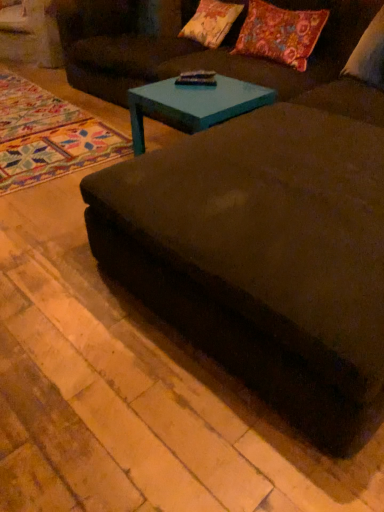
Identify the location of floral fabric pillow at upper center, which appears as the 1th pillow when viewed from the left. This screenshot has width=384, height=512. (211, 22).

You are a GUI agent. You are given a task and a screenshot of the screen. Output one action in this format:
    pyautogui.click(x=<x>, y=<y>)
    Task: Click on the white soft pillow at upper right, which appears as the 3th pillow when viewed from the left
    
    Given the screenshot: What is the action you would take?
    pyautogui.click(x=369, y=54)

In order to click on floral fabric pillow at upper center, which appears as the 1th pillow when viewed from the left in this screenshot , I will do `click(211, 22)`.

In terms of width, does multicolored woven rug at lower left look wider or thinner when compared to dark brown fabric couch at center?

Clearly, multicolored woven rug at lower left has more width compared to dark brown fabric couch at center.

From the image's perspective, which one is positioned higher, multicolored woven rug at lower left or dark brown fabric couch at center?

dark brown fabric couch at center.

Is multicolored woven rug at lower left with dark brown fabric couch at center?

They are not placed beside each other.

Is multicolored woven rug at lower left taller or shorter than dark brown fabric couch at center?

In the image, multicolored woven rug at lower left appears to be shorter than dark brown fabric couch at center.

Considering the sizes of objects teal glossy coffee table at center and multicolored woven rug at lower left in the image provided, who is smaller, teal glossy coffee table at center or multicolored woven rug at lower left?

teal glossy coffee table at center is smaller.

Is teal glossy coffee table at center completely or partially outside of multicolored woven rug at lower left?

teal glossy coffee table at center lies outside multicolored woven rug at lower left's area.

Between teal glossy coffee table at center and multicolored woven rug at lower left, which one appears on the left side from the viewer's perspective?

multicolored woven rug at lower left.

From a real-world perspective, is teal glossy coffee table at center physically located above or below multicolored woven rug at lower left?

teal glossy coffee table at center is situated higher than multicolored woven rug at lower left in the real world.

From the picture: From the image's perspective, between floral fabric pillow at upper right, which is the second pillow in right-to-left order, and floral fabric pillow at upper center, marked as the 3th pillow in a right-to-left arrangement, which one is located above?

floral fabric pillow at upper center, marked as the 3th pillow in a right-to-left arrangement, from the image's perspective.

Looking at this image, which object is further away from the camera taking this photo, floral fabric pillow at upper right, which ranks as the 2th pillow in left-to-right order, or floral fabric pillow at upper center, marked as the 3th pillow in a right-to-left arrangement?

floral fabric pillow at upper center, marked as the 3th pillow in a right-to-left arrangement.

Which is behind, point (260, 17) or point (211, 30)?

The point (211, 30) is behind.

Is floral fabric pillow at upper center, which appears as the 1th pillow when viewed from the left, a part of floral fabric pillow at upper right, which is the second pillow in right-to-left order?

No, floral fabric pillow at upper center, which appears as the 1th pillow when viewed from the left, is not surrounded by floral fabric pillow at upper right, which is the second pillow in right-to-left order.

Is there a large distance between velvet dark brown couch at center and multicolored woven rug at lower left?

velvet dark brown couch at center is far away from multicolored woven rug at lower left.

The width and height of the screenshot is (384, 512). Identify the location of studio couch that appears below the multicolored woven rug at lower left (from the image's perspective). (266, 252).

Is the position of velvet dark brown couch at center less distant than that of multicolored woven rug at lower left?

Yes, it is in front of multicolored woven rug at lower left.

From the image's perspective, is velvet dark brown couch at center beneath multicolored woven rug at lower left?

Indeed, from the image's perspective, velvet dark brown couch at center is shown beneath multicolored woven rug at lower left.

Which object is closer to the camera taking this photo, velvet dark brown couch at center or floral fabric pillow at upper center, marked as the 3th pillow in a right-to-left arrangement?

velvet dark brown couch at center.

The width and height of the screenshot is (384, 512). Identify the location of the 1st pillow located above the velvet dark brown couch at center (from a real-world perspective). point(211,22).

Between velvet dark brown couch at center and floral fabric pillow at upper center, marked as the 3th pillow in a right-to-left arrangement, which one has larger size?

With larger size is velvet dark brown couch at center.

From a real-world perspective, is velvet dark brown couch at center physically located above or below floral fabric pillow at upper center, marked as the 3th pillow in a right-to-left arrangement?

velvet dark brown couch at center is below floral fabric pillow at upper center, marked as the 3th pillow in a right-to-left arrangement.

Considering the relative sizes of white soft pillow at upper right, acting as the first pillow starting from the right, and dark brown fabric couch at center in the image provided, is white soft pillow at upper right, acting as the first pillow starting from the right, bigger than dark brown fabric couch at center?

Incorrect, white soft pillow at upper right, acting as the first pillow starting from the right, is not larger than dark brown fabric couch at center.

From the image's perspective, between white soft pillow at upper right, acting as the first pillow starting from the right, and dark brown fabric couch at center, which one is located above?

From the image's view, dark brown fabric couch at center is above.

Considering the relative sizes of white soft pillow at upper right, acting as the first pillow starting from the right, and dark brown fabric couch at center in the image provided, is white soft pillow at upper right, acting as the first pillow starting from the right, taller than dark brown fabric couch at center?

In fact, white soft pillow at upper right, acting as the first pillow starting from the right, may be shorter than dark brown fabric couch at center.

Which is more to the right, white soft pillow at upper right, acting as the first pillow starting from the right, or dark brown fabric couch at center?

white soft pillow at upper right, acting as the first pillow starting from the right, is more to the right.

Consider the image. Which is more to the right, floral fabric pillow at upper right, which ranks as the 2th pillow in left-to-right order, or dark brown fabric couch at center?

floral fabric pillow at upper right, which ranks as the 2th pillow in left-to-right order.

In terms of size, does floral fabric pillow at upper right, which is the second pillow in right-to-left order, appear bigger or smaller than dark brown fabric couch at center?

In the image, floral fabric pillow at upper right, which is the second pillow in right-to-left order, appears to be smaller than dark brown fabric couch at center.

From the image's perspective, who appears lower, floral fabric pillow at upper right, which is the second pillow in right-to-left order, or dark brown fabric couch at center?

dark brown fabric couch at center, from the image's perspective.

What are the coordinates of `mat behind the dark brown fabric couch at center` in the screenshot? It's located at (48, 136).

In the image, there is a teal glossy coffee table at center. In order to click on mat below it (from a real-world perspective) in this screenshot , I will do `click(48, 136)`.

Estimate the real-world distances between objects in this image. Which object is further from floral fabric pillow at upper right, which ranks as the 2th pillow in left-to-right order, multicolored woven rug at lower left or white soft pillow at upper right, which appears as the 3th pillow when viewed from the left?

multicolored woven rug at lower left.

Consider the image. Based on their spatial positions, is teal glossy coffee table at center or floral fabric pillow at upper center, which appears as the 1th pillow when viewed from the left, closer to multicolored woven rug at lower left?

teal glossy coffee table at center.

Considering their positions, is multicolored woven rug at lower left positioned further to floral fabric pillow at upper center, marked as the 3th pillow in a right-to-left arrangement, than floral fabric pillow at upper right, which is the second pillow in right-to-left order?

The object further to floral fabric pillow at upper center, marked as the 3th pillow in a right-to-left arrangement, is multicolored woven rug at lower left.

Estimate the real-world distances between objects in this image. Which object is further from dark brown fabric couch at center, floral fabric pillow at upper right, which is the second pillow in right-to-left order, or teal glossy coffee table at center?

teal glossy coffee table at center is further to dark brown fabric couch at center.

Which object lies further to the anchor point dark brown fabric couch at center, teal glossy coffee table at center or white soft pillow at upper right, which appears as the 3th pillow when viewed from the left?

The object further to dark brown fabric couch at center is white soft pillow at upper right, which appears as the 3th pillow when viewed from the left.

Estimate the real-world distances between objects in this image. Which object is closer to teal glossy coffee table at center, dark brown fabric couch at center or white soft pillow at upper right, which appears as the 3th pillow when viewed from the left?

dark brown fabric couch at center.

Based on their spatial positions, is velvet dark brown couch at center or multicolored woven rug at lower left closer to floral fabric pillow at upper right, which ranks as the 2th pillow in left-to-right order?

multicolored woven rug at lower left is positioned closer to the anchor floral fabric pillow at upper right, which ranks as the 2th pillow in left-to-right order.

Based on their spatial positions, is teal glossy coffee table at center or dark brown fabric couch at center further from floral fabric pillow at upper center, which appears as the 1th pillow when viewed from the left?

Based on the image, teal glossy coffee table at center appears to be further to floral fabric pillow at upper center, which appears as the 1th pillow when viewed from the left.

Image resolution: width=384 pixels, height=512 pixels. I want to click on coffee table situated between multicolored woven rug at lower left and dark brown fabric couch at center from left to right, so click(193, 103).

Identify the location of coffee table between velvet dark brown couch at center and floral fabric pillow at upper right, which is the second pillow in right-to-left order, along the z-axis. The height and width of the screenshot is (512, 384). (193, 103).

You are a GUI agent. You are given a task and a screenshot of the screen. Output one action in this format:
    pyautogui.click(x=<x>, y=<y>)
    Task: Click on the coffee table between dark brown fabric couch at center and floral fabric pillow at upper center, which appears as the 1th pillow when viewed from the left, along the z-axis
    This screenshot has width=384, height=512.
    Given the screenshot: What is the action you would take?
    pyautogui.click(x=193, y=103)

Where is `studio couch between multicolored woven rug at lower left and white soft pillow at upper right, acting as the first pillow starting from the right, in the horizontal direction`? This screenshot has height=512, width=384. studio couch between multicolored woven rug at lower left and white soft pillow at upper right, acting as the first pillow starting from the right, in the horizontal direction is located at coordinates (266, 252).